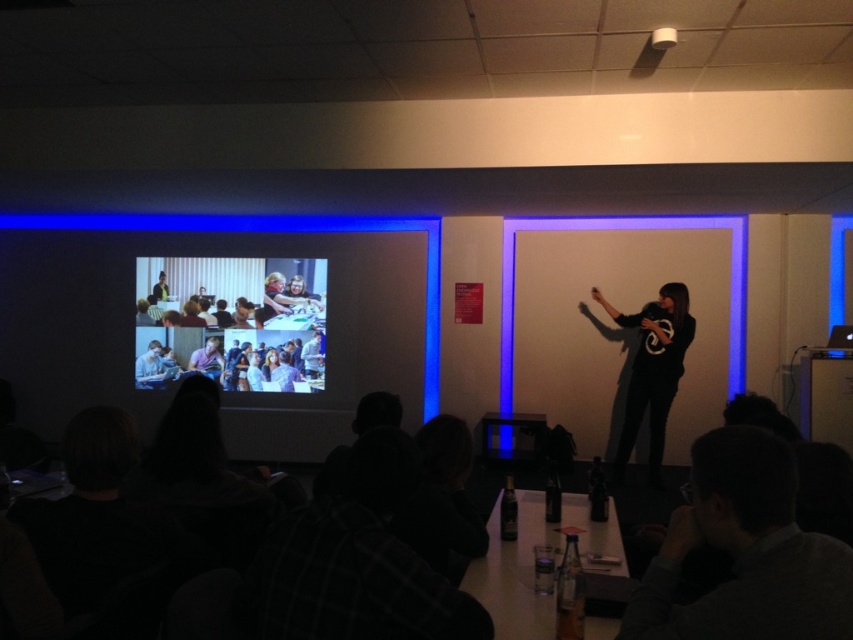
Question: Which point is farther to the camera?

Choices:
 (A) (796, 554)
 (B) (694, 305)
 (C) (267, 369)
 (D) (647, 401)

Answer: (C)

Question: Based on their relative distances, which object is nearer to the whiteboard at center?

Choices:
 (A) black matte shirt at center
 (B) gray sweater at lower right

Answer: (A)

Question: Is whiteboard at center to the left of gray sweater at lower right from the viewer's perspective?

Choices:
 (A) yes
 (B) no

Answer: (B)

Question: Is gray sweater at lower right smaller than matte plastic projector screen at center?

Choices:
 (A) yes
 (B) no

Answer: (A)

Question: Considering the real-world distances, which object is closest to the gray sweater at lower right?

Choices:
 (A) whiteboard at center
 (B) matte plastic projector screen at center

Answer: (A)

Question: Where is whiteboard at center located in relation to black matte shirt at center in the image?

Choices:
 (A) above
 (B) below

Answer: (A)